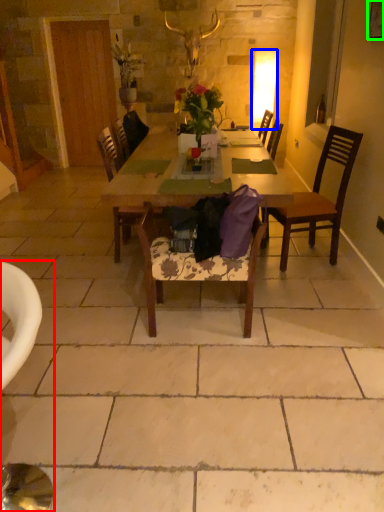
Question: Based on their relative distances, which object is nearer to chair (highlighted by a red box)? Choose from lamp (highlighted by a blue box) and picture frame (highlighted by a green box).

Choices:
 (A) lamp
 (B) picture frame

Answer: (B)